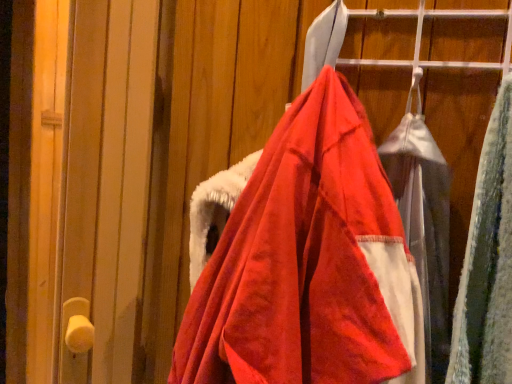
The height and width of the screenshot is (384, 512). In order to click on matte white screen door at left in this screenshot , I will do `click(79, 183)`.

What is the approximate height of matte white screen door at left?

26.75 inches.

This screenshot has height=384, width=512. What do you see at coordinates (79, 183) in the screenshot?
I see `matte white screen door at left` at bounding box center [79, 183].

Identify the location of matte white screen door at left. This screenshot has width=512, height=384. (79, 183).